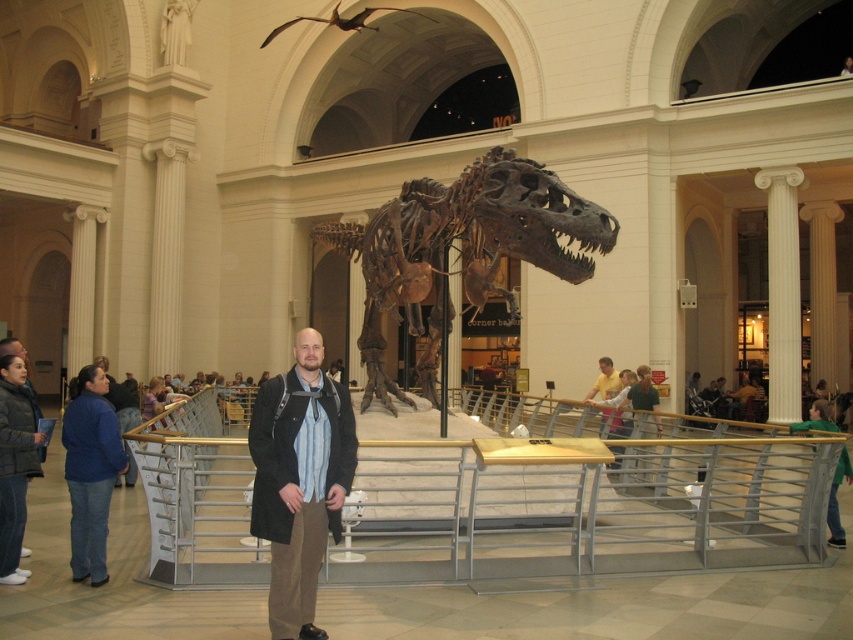
You are a visitor in the museum and want to take a photo of the green fabric jacket at lower right without the rusty metallic dinosaur at center appearing in the frame. Is this possible given their positions?

The rusty metallic dinosaur at center is to the left of the green fabric jacket at lower right, so you can position yourself to the right side of the jacket to exclude the dinosaur from the photo frame.

Consider the image. You are a visitor in the museum and want to take a photo of both the rusty metallic dinosaur at center and the green fabric jacket at lower right. Since you want to capture both in a single frame, which object should you focus on to ensure both are visible?

You should focus on the rusty metallic dinosaur at center because it is narrower than the green fabric jacket at lower right, allowing both to fit within the camera frame more easily.